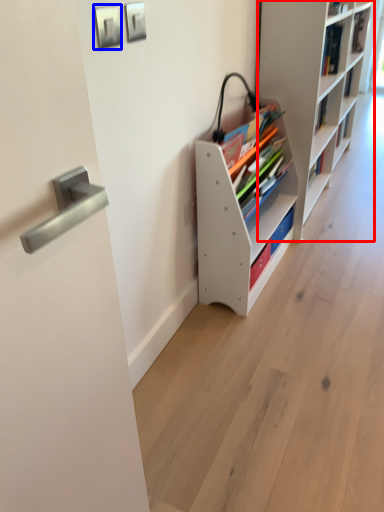
Question: Which of the following is the closest to the observer, shelf (highlighted by a red box) or picture frame (highlighted by a blue box)?

Choices:
 (A) shelf
 (B) picture frame

Answer: (B)